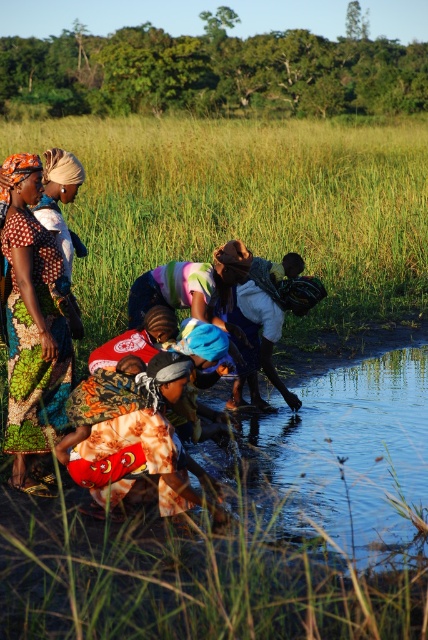
Question: Among these objects, which one is nearest to the camera?

Choices:
 (A) printed fabric child at lower center
 (B) printed fabric dress at center

Answer: (A)

Question: Which point appears farthest from the camera in this image?

Choices:
 (A) (154, 426)
 (B) (23, 198)

Answer: (B)

Question: Is the position of printed fabric dress at center less distant than that of printed fabric child at lower center?

Choices:
 (A) no
 (B) yes

Answer: (A)

Question: Is printed fabric dress at center further to camera compared to printed fabric child at lower center?

Choices:
 (A) no
 (B) yes

Answer: (B)

Question: Is printed fabric dress at center wider than printed fabric child at lower center?

Choices:
 (A) yes
 (B) no

Answer: (B)

Question: Among these points, which one is nearest to the camera?

Choices:
 (A) (29, 380)
 (B) (119, 374)

Answer: (B)